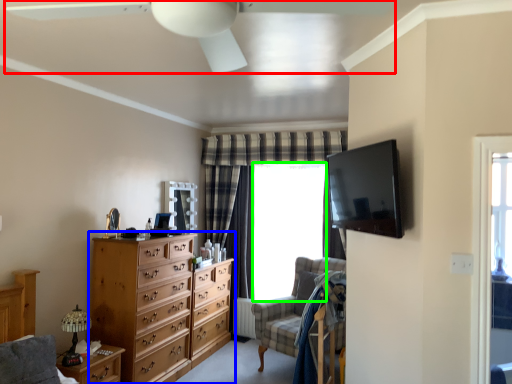
Question: Which is nearer to the ceiling fan (highlighted by a red box)? chest of drawers (highlighted by a blue box) or window screen (highlighted by a green box).

Choices:
 (A) chest of drawers
 (B) window screen

Answer: (A)